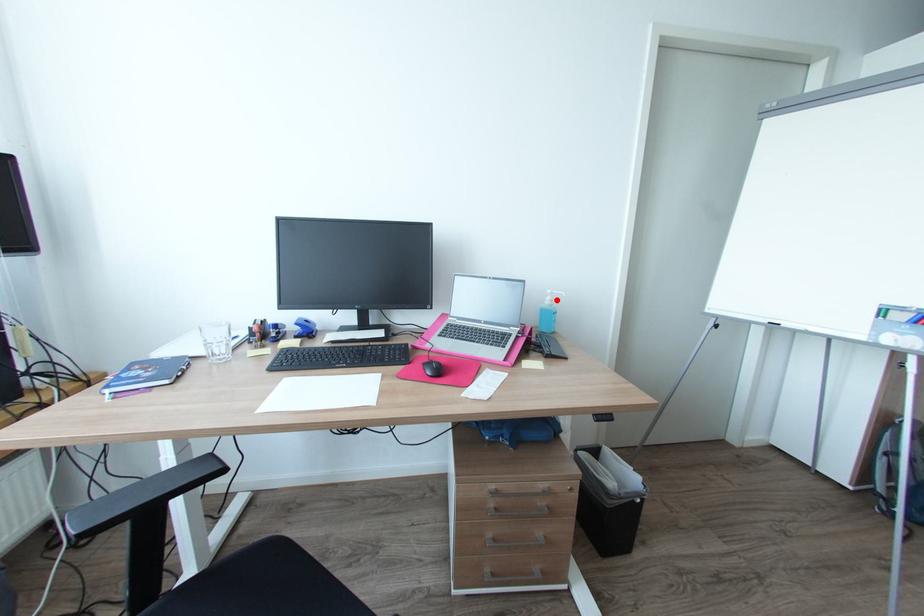
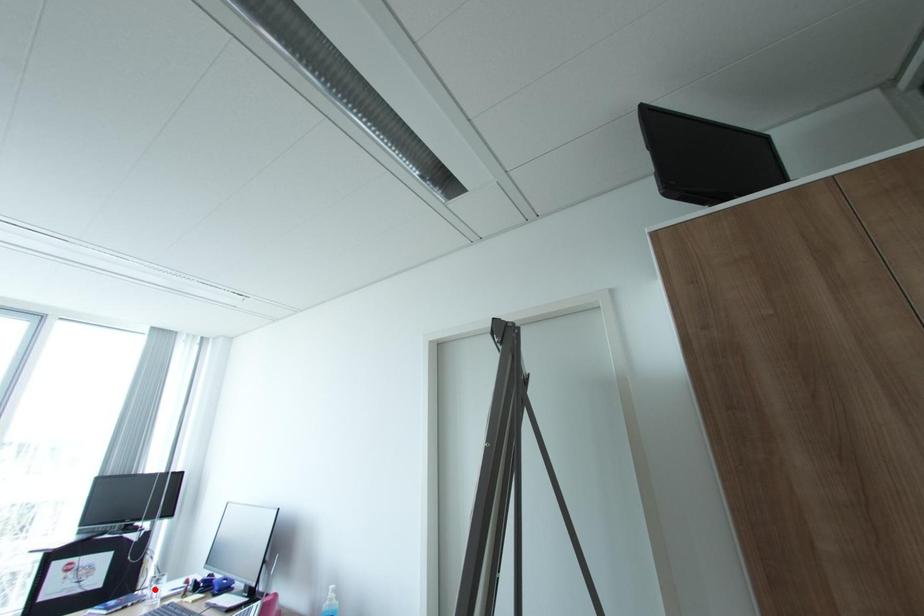
I am providing you with two images of the same scene from different viewpoints. A red point is marked on the first image and another point is marked on the second image. Is the red point in image1 aligned with the point shown in image2?

No